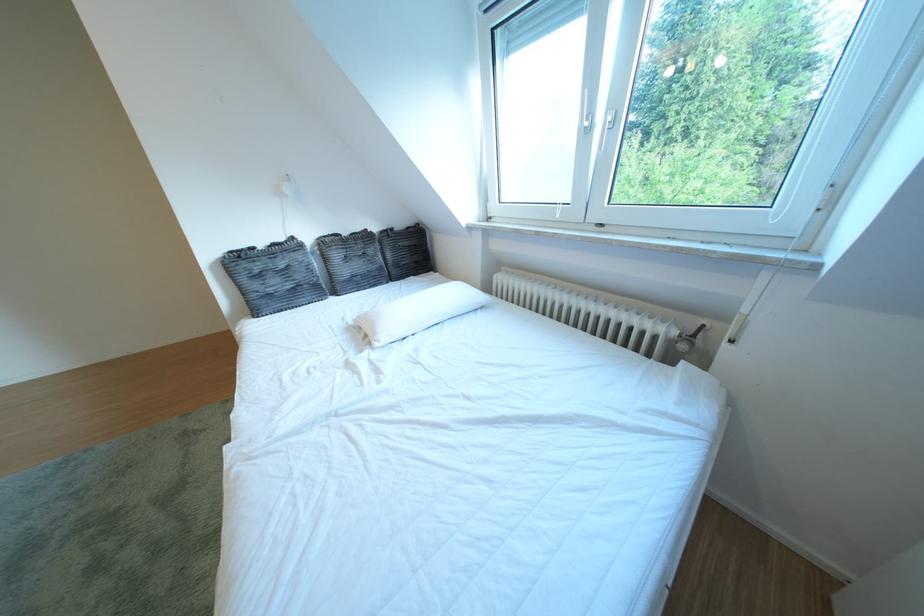
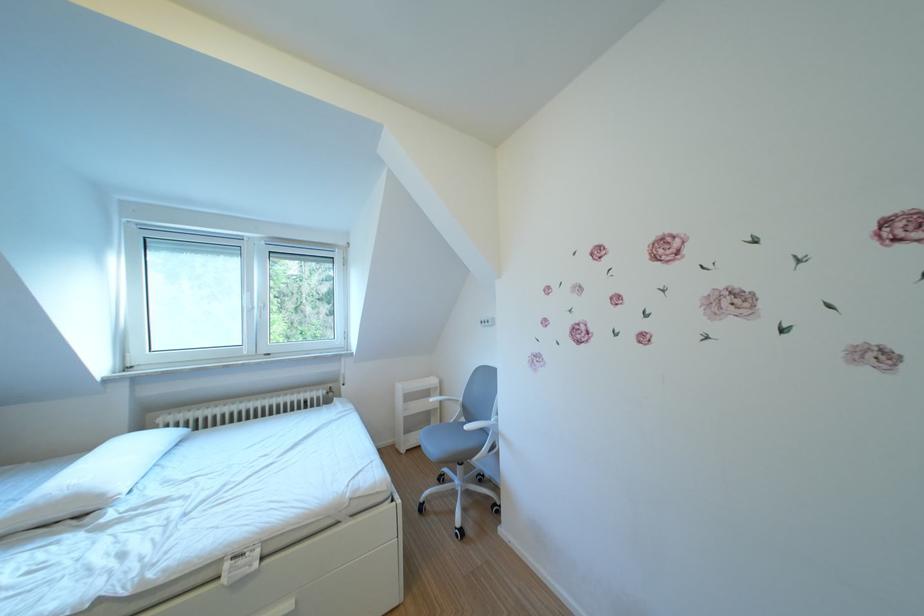
Locate, in the second image, the point that corresponds to point 603,119 in the first image.

(265, 307)